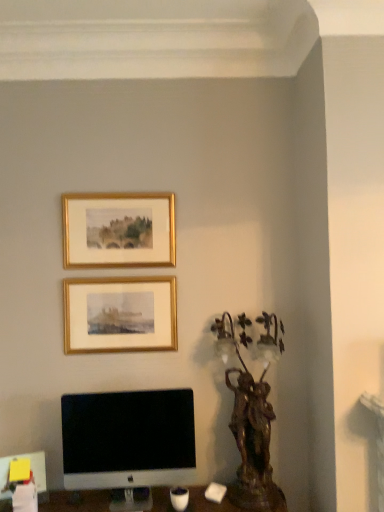
At what (x,y) coordinates should I click in order to perform the action: click on gold/gilded picture frame at upper center, the 2th picture frame from the bottom. Please return your answer as a coordinate pair (x, y). The width and height of the screenshot is (384, 512). Looking at the image, I should click on (118, 230).

Where is `gold/gilded picture frame at upper center, the 1th picture frame from the bottom`? gold/gilded picture frame at upper center, the 1th picture frame from the bottom is located at coordinates (120, 314).

The width and height of the screenshot is (384, 512). In order to click on bronze statue at right in this screenshot , I will do `click(249, 431)`.

You are a GUI agent. You are given a task and a screenshot of the screen. Output one action in this format:
    pyautogui.click(x=<x>, y=<y>)
    Task: Click on the gold/gilded picture frame at upper center, which is counted as the first picture frame, starting from the top
    
    Given the screenshot: What is the action you would take?
    pyautogui.click(x=118, y=230)

Which is in front, white glossy computer monitor at lower left or bronze statue at right?

bronze statue at right.

Looking at this image, from a real-world perspective, is white glossy computer monitor at lower left above or below bronze statue at right?

From a real-world perspective, white glossy computer monitor at lower left is physically below bronze statue at right.

Looking at this image, can you confirm if white glossy computer monitor at lower left is positioned to the right of bronze statue at right?

Incorrect, white glossy computer monitor at lower left is not on the right side of bronze statue at right.

Is white glossy computer monitor at lower left positioned far away from bronze statue at right?

No, white glossy computer monitor at lower left is not far away from bronze statue at right.

Is gold/gilded picture frame at upper center, the 2th picture frame from the bottom, turned away from gold/gilded picture frame at upper center, positioned as the 2th picture frame in top-to-bottom order?

No, gold/gilded picture frame at upper center, the 2th picture frame from the bottom, is not facing away from gold/gilded picture frame at upper center, positioned as the 2th picture frame in top-to-bottom order.

Can you confirm if gold/gilded picture frame at upper center, which is counted as the first picture frame, starting from the top, is bigger than gold/gilded picture frame at upper center, the 1th picture frame from the bottom?

Indeed, gold/gilded picture frame at upper center, which is counted as the first picture frame, starting from the top, has a larger size compared to gold/gilded picture frame at upper center, the 1th picture frame from the bottom.

Could gold/gilded picture frame at upper center, the 1th picture frame from the bottom, be considered to be inside gold/gilded picture frame at upper center, the 2th picture frame from the bottom?

No, gold/gilded picture frame at upper center, the 1th picture frame from the bottom, is not surrounded by gold/gilded picture frame at upper center, the 2th picture frame from the bottom.

You are a GUI agent. You are given a task and a screenshot of the screen. Output one action in this format:
    pyautogui.click(x=<x>, y=<y>)
    Task: Click on the picture frame that appears in front of the gold/gilded picture frame at upper center, which is counted as the first picture frame, starting from the top
    
    Given the screenshot: What is the action you would take?
    pyautogui.click(x=120, y=314)

Does point (77, 205) appear closer or farther from the camera than point (248, 425)?

Point (77, 205) is positioned farther from the camera compared to point (248, 425).

Could you tell me if gold/gilded picture frame at upper center, which is counted as the first picture frame, starting from the top, is facing bronze statue at right?

No.

From a real-world perspective, which is physically above, gold/gilded picture frame at upper center, which is counted as the first picture frame, starting from the top, or bronze statue at right?

From a 3D spatial view, gold/gilded picture frame at upper center, which is counted as the first picture frame, starting from the top, is above.

Is gold/gilded picture frame at upper center, which is counted as the first picture frame, starting from the top, not within bronze statue at right?

Indeed, gold/gilded picture frame at upper center, which is counted as the first picture frame, starting from the top, is completely outside bronze statue at right.

Are gold/gilded picture frame at upper center, which is counted as the first picture frame, starting from the top, and white glossy computer monitor at lower left making contact?

gold/gilded picture frame at upper center, which is counted as the first picture frame, starting from the top, and white glossy computer monitor at lower left are not in contact.

Can you confirm if gold/gilded picture frame at upper center, the 2th picture frame from the bottom, is thinner than white glossy computer monitor at lower left?

Yes, gold/gilded picture frame at upper center, the 2th picture frame from the bottom, is thinner than white glossy computer monitor at lower left.

Which is more to the left, gold/gilded picture frame at upper center, which is counted as the first picture frame, starting from the top, or white glossy computer monitor at lower left?

Positioned to the left is gold/gilded picture frame at upper center, which is counted as the first picture frame, starting from the top.

Where is `picture frame in front of the gold/gilded picture frame at upper center, which is counted as the first picture frame, starting from the top`? picture frame in front of the gold/gilded picture frame at upper center, which is counted as the first picture frame, starting from the top is located at coordinates (120, 314).

Is gold/gilded picture frame at upper center, the 1th picture frame from the bottom, not within gold/gilded picture frame at upper center, which is counted as the first picture frame, starting from the top?

Yes.

From the picture: Are gold/gilded picture frame at upper center, positioned as the 2th picture frame in top-to-bottom order, and gold/gilded picture frame at upper center, which is counted as the first picture frame, starting from the top, making contact?

gold/gilded picture frame at upper center, positioned as the 2th picture frame in top-to-bottom order, is not next to gold/gilded picture frame at upper center, which is counted as the first picture frame, starting from the top, and they're not touching.

Do you think gold/gilded picture frame at upper center, the 1th picture frame from the bottom, is within white glossy computer monitor at lower left, or outside of it?

gold/gilded picture frame at upper center, the 1th picture frame from the bottom, lies outside white glossy computer monitor at lower left.

From a real-world perspective, is gold/gilded picture frame at upper center, positioned as the 2th picture frame in top-to-bottom order, above or below white glossy computer monitor at lower left?

In terms of real-world spatial position, gold/gilded picture frame at upper center, positioned as the 2th picture frame in top-to-bottom order, is above white glossy computer monitor at lower left.

From the image's perspective, is gold/gilded picture frame at upper center, positioned as the 2th picture frame in top-to-bottom order, located above white glossy computer monitor at lower left?

Yes, from the image's perspective, gold/gilded picture frame at upper center, positioned as the 2th picture frame in top-to-bottom order, is on top of white glossy computer monitor at lower left.

Can you see bronze statue at right touching white glossy computer monitor at lower left?

bronze statue at right is not next to white glossy computer monitor at lower left, and they're not touching.

Between bronze statue at right and white glossy computer monitor at lower left, which one is positioned behind?

white glossy computer monitor at lower left.

Locate an element on the screen. This screenshot has height=512, width=384. bronze statue located in front of the white glossy computer monitor at lower left is located at coordinates (249, 431).

How different are the orientations of bronze statue at right and white glossy computer monitor at lower left in degrees?

The angular difference between bronze statue at right and white glossy computer monitor at lower left is 1.12 degrees.

The height and width of the screenshot is (512, 384). Identify the location of bronze statue located in front of the white glossy computer monitor at lower left. (249, 431).

Locate an element on the screen. This screenshot has width=384, height=512. picture frame directly beneath the gold/gilded picture frame at upper center, which is counted as the first picture frame, starting from the top (from a real-world perspective) is located at coordinates (120, 314).

Based on their spatial positions, is white glossy computer monitor at lower left or bronze statue at right further from gold/gilded picture frame at upper center, positioned as the 2th picture frame in top-to-bottom order?

bronze statue at right lies further to gold/gilded picture frame at upper center, positioned as the 2th picture frame in top-to-bottom order, than the other object.

Which object lies nearer to the anchor point bronze statue at right, gold/gilded picture frame at upper center, the 2th picture frame from the bottom, or white glossy computer monitor at lower left?

The object closer to bronze statue at right is white glossy computer monitor at lower left.

Estimate the real-world distances between objects in this image. Which object is further from white glossy computer monitor at lower left, gold/gilded picture frame at upper center, the 1th picture frame from the bottom, or bronze statue at right?

bronze statue at right is further to white glossy computer monitor at lower left.

Based on their spatial positions, is gold/gilded picture frame at upper center, which is counted as the first picture frame, starting from the top, or white glossy computer monitor at lower left further from gold/gilded picture frame at upper center, positioned as the 2th picture frame in top-to-bottom order?

The object further to gold/gilded picture frame at upper center, positioned as the 2th picture frame in top-to-bottom order, is white glossy computer monitor at lower left.

Considering their positions, is bronze statue at right positioned closer to gold/gilded picture frame at upper center, positioned as the 2th picture frame in top-to-bottom order, than white glossy computer monitor at lower left?

white glossy computer monitor at lower left is closer to gold/gilded picture frame at upper center, positioned as the 2th picture frame in top-to-bottom order.

From the image, which object appears to be farther from bronze statue at right, gold/gilded picture frame at upper center, the 1th picture frame from the bottom, or gold/gilded picture frame at upper center, which is counted as the first picture frame, starting from the top?

Among the two, gold/gilded picture frame at upper center, which is counted as the first picture frame, starting from the top, is located further to bronze statue at right.

Considering their positions, is bronze statue at right positioned closer to gold/gilded picture frame at upper center, the 2th picture frame from the bottom, than gold/gilded picture frame at upper center, the 1th picture frame from the bottom?

Among the two, gold/gilded picture frame at upper center, the 1th picture frame from the bottom, is located nearer to gold/gilded picture frame at upper center, the 2th picture frame from the bottom.

From the image, which object appears to be farther from bronze statue at right, white glossy computer monitor at lower left or gold/gilded picture frame at upper center, positioned as the 2th picture frame in top-to-bottom order?

gold/gilded picture frame at upper center, positioned as the 2th picture frame in top-to-bottom order, is positioned further to the anchor bronze statue at right.

This screenshot has height=512, width=384. Identify the location of picture frame between gold/gilded picture frame at upper center, the 2th picture frame from the bottom, and bronze statue at right in the up-down direction. (120, 314).

Locate an element on the screen. This screenshot has width=384, height=512. computer monitor located between gold/gilded picture frame at upper center, positioned as the 2th picture frame in top-to-bottom order, and bronze statue at right in the left-right direction is located at coordinates (128, 440).

At what (x,y) coordinates should I click in order to perform the action: click on bronze statue that lies between gold/gilded picture frame at upper center, which is counted as the first picture frame, starting from the top, and white glossy computer monitor at lower left from top to bottom. Please return your answer as a coordinate pair (x, y). Image resolution: width=384 pixels, height=512 pixels. Looking at the image, I should click on (249, 431).

Locate an element on the screen. picture frame between gold/gilded picture frame at upper center, which is counted as the first picture frame, starting from the top, and white glossy computer monitor at lower left vertically is located at coordinates (120, 314).